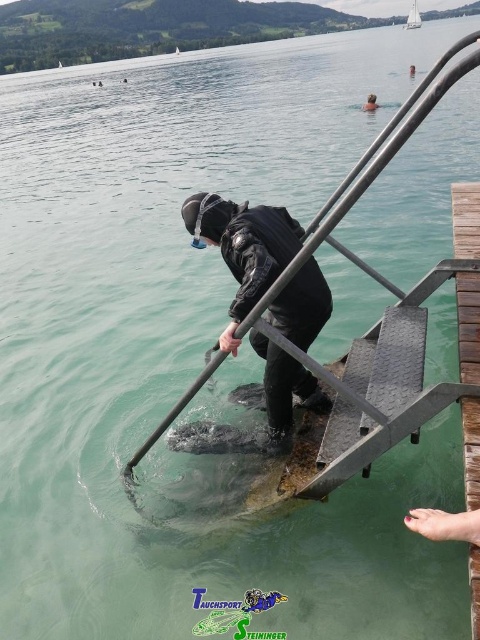
What do you see at coordinates (444, 524) in the screenshot?
I see `smooth skin foot at lower right` at bounding box center [444, 524].

What do you see at coordinates (444, 524) in the screenshot? I see `smooth skin foot at lower right` at bounding box center [444, 524].

The image size is (480, 640). Identify the location of smooth skin foot at lower right. (444, 524).

Is point (243, 227) farther from camera compared to point (447, 534)?

Yes, it is behind point (447, 534).

In order to click on black matte diving suit at center in this screenshot , I will do `click(242, 248)`.

Describe the element at coordinates (242, 248) in the screenshot. I see `black matte diving suit at center` at that location.

Between black matte diving suit at center and white plastic boat at upper center, which one appears on the left side from the viewer's perspective?

black matte diving suit at center is more to the left.

Is point (240, 280) positioned in front of point (408, 28)?

Yes, point (240, 280) is closer to viewer.

You are a GUI agent. You are given a task and a screenshot of the screen. Output one action in this format:
    pyautogui.click(x=<x>, y=<y>)
    Task: Click on the black matte diving suit at center
    The width and height of the screenshot is (480, 640).
    Given the screenshot: What is the action you would take?
    pyautogui.click(x=242, y=248)